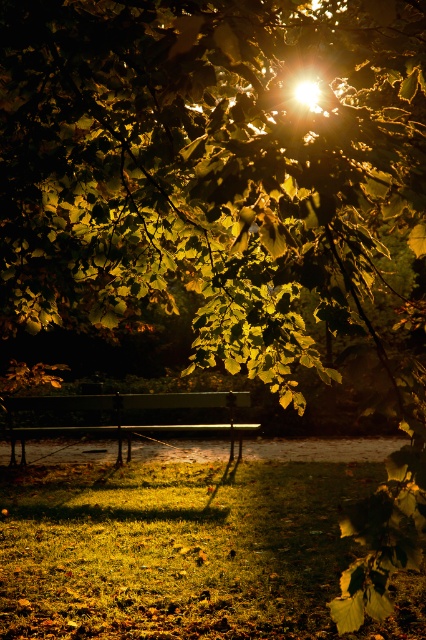
Question: Is green matte bench at center bigger than matte glass light at upper center?

Choices:
 (A) no
 (B) yes

Answer: (B)

Question: Is the position of green matte bench at center more distant than that of matte glass light at upper center?

Choices:
 (A) no
 (B) yes

Answer: (B)

Question: Which point appears farthest from the camera in this image?

Choices:
 (A) (317, 108)
 (B) (16, 400)

Answer: (B)

Question: Does green matte bench at center have a lesser width compared to matte glass light at upper center?

Choices:
 (A) yes
 (B) no

Answer: (B)